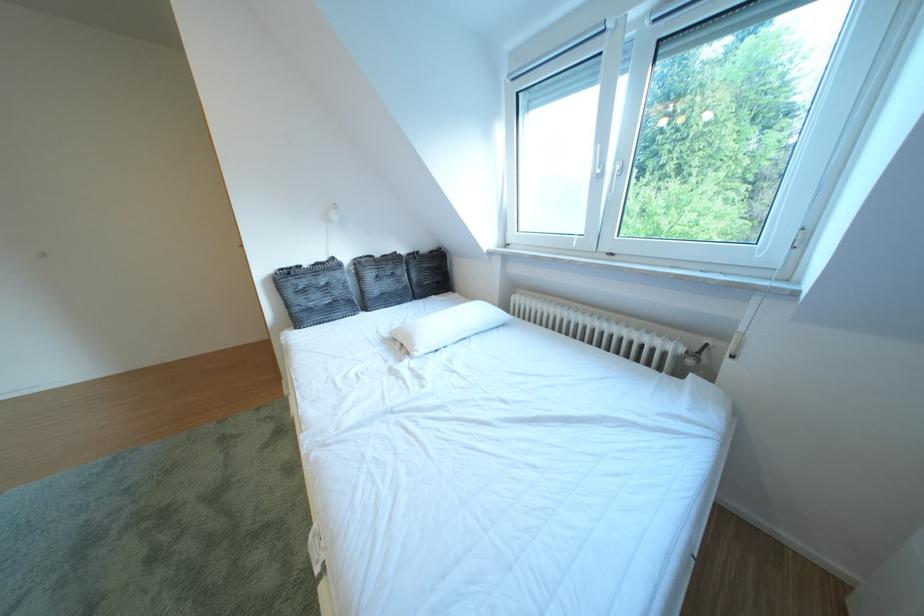
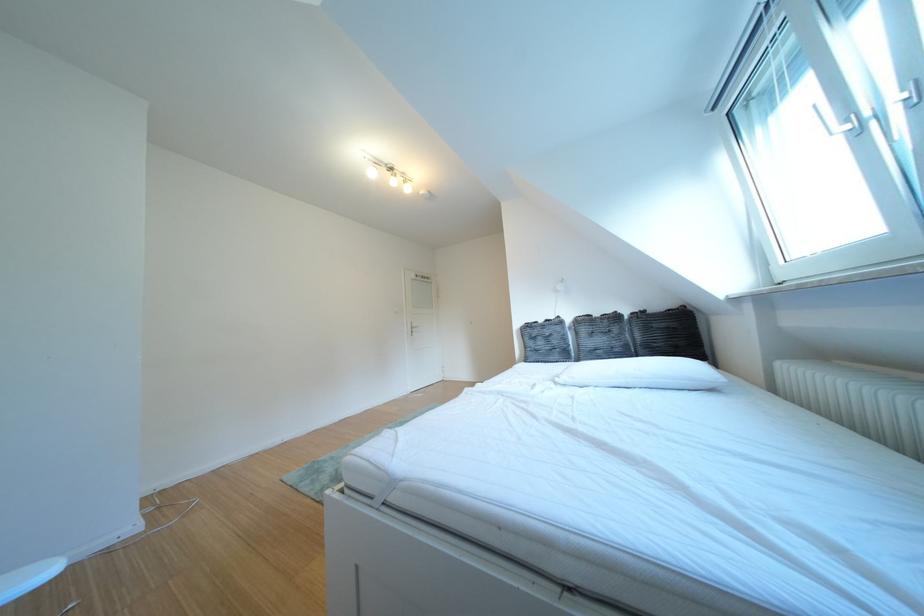
Question: The first image is from the beginning of the video and the second image is from the end. How did the camera likely rotate when shooting the video?

Choices:
 (A) Left
 (B) Right
 (C) Up
 (D) Down

Answer: (A)